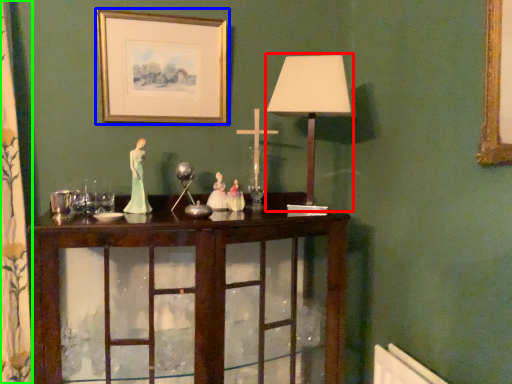
Question: Estimate the real-world distances between objects in this image. Which object is farther from table lamp (highlighted by a red box), picture frame (highlighted by a blue box) or curtain (highlighted by a green box)?

Choices:
 (A) picture frame
 (B) curtain

Answer: (B)